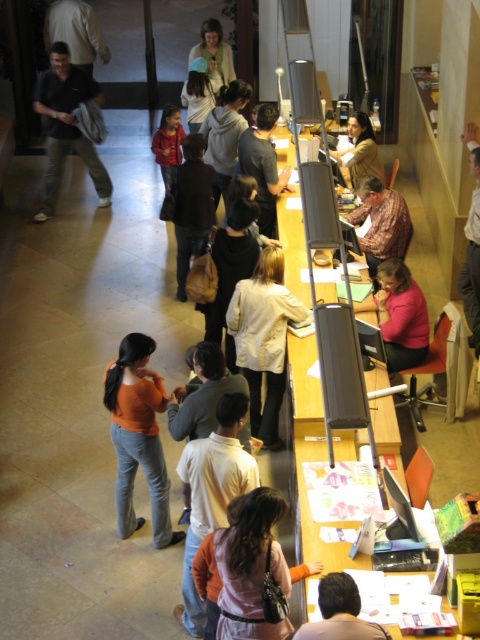
You are a delivery person who needs to place a package that is 1.2 meters long on the floor between the light brown shirt at center and the brown leather jacket at lower center. Is there enough space for the package?

The distance between the light brown shirt at center and the brown leather jacket at lower center is 1.11 meters. Since the package is 1.2 meters long, it will not fit in the available space.

You are standing at the center of the scene. Which object from the list is located to your left side? The objects are matte black jacket at left.

The matte black jacket at left is located at point (67, 125), which is to the left side from your central position.

You are standing at the counter in the library and need to reach both the point at (213, 524) and the point at (354, 628). Which point is closer to you?

The point at (213, 524) is closer to you because it is further to the viewer than the point at (354, 628).